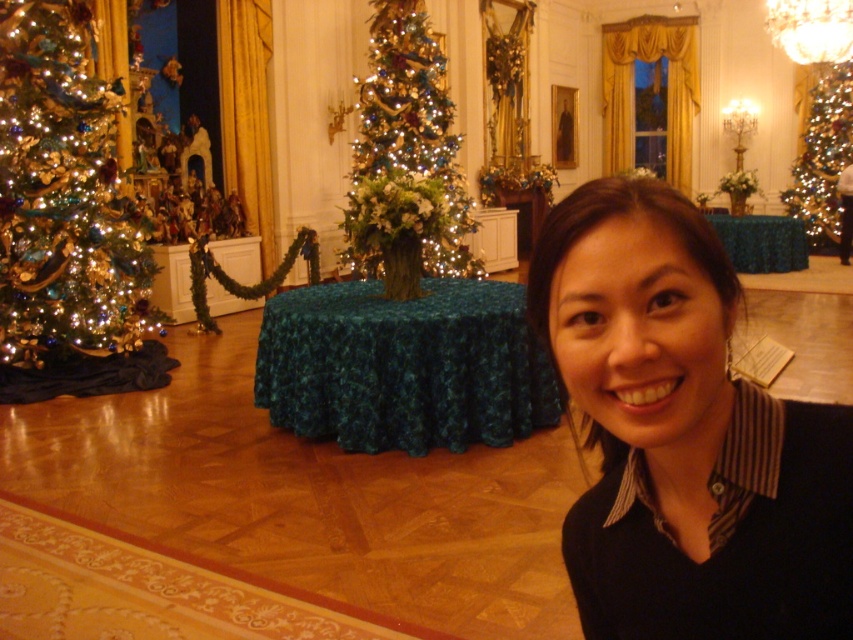
You are a guest at this Christmas party and want to take a photo with both the black striped shirt at center and the shiny gold ornaments at left. Since you want to ensure both are clearly visible in the photo, which item should you position closer to the camera to maintain their visibility?

The black striped shirt at center is smaller in size compared to the shiny gold ornaments at left, so to ensure both are clearly visible in the photo, you should position the black striped shirt at center closer to the camera. This will help balance their sizes in the frame, making both items appear more equally sized and visible.

You are a guest at a Christmas party and see the black striped shirt at center and the shiny gold ornaments at left. Which object is closer to you?

The black striped shirt at center is closer to you because it is in front of the shiny gold ornaments at left.

You are a guest at the Christmas party and want to take a photo with both the black striped shirt at center and the iridescent glass christmas tree at center. Which object should you stand closer to in order to include both in the frame?

Since the black striped shirt at center is shorter than the iridescent glass christmas tree at center, you should stand closer to the black striped shirt at center to ensure both objects are in the frame.